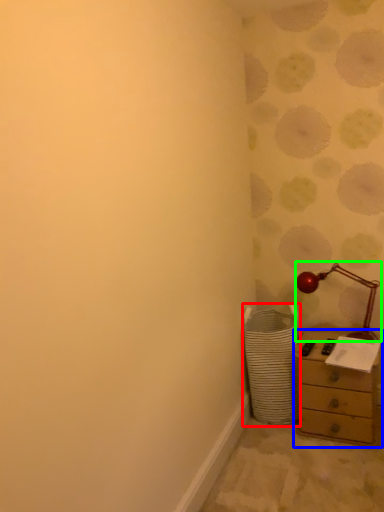
Question: Considering the real-world distances, which object is closest to laundry basket (highlighted by a red box)? chest of drawers (highlighted by a blue box) or table lamp (highlighted by a green box).

Choices:
 (A) chest of drawers
 (B) table lamp

Answer: (A)